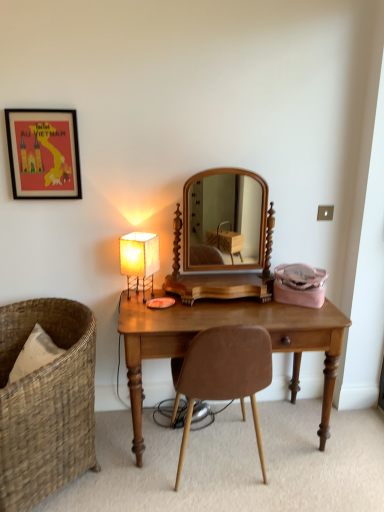
Find the location of a particular element. The height and width of the screenshot is (512, 384). free spot above wooden desk at center (from a real-world perspective) is located at coordinates (207, 305).